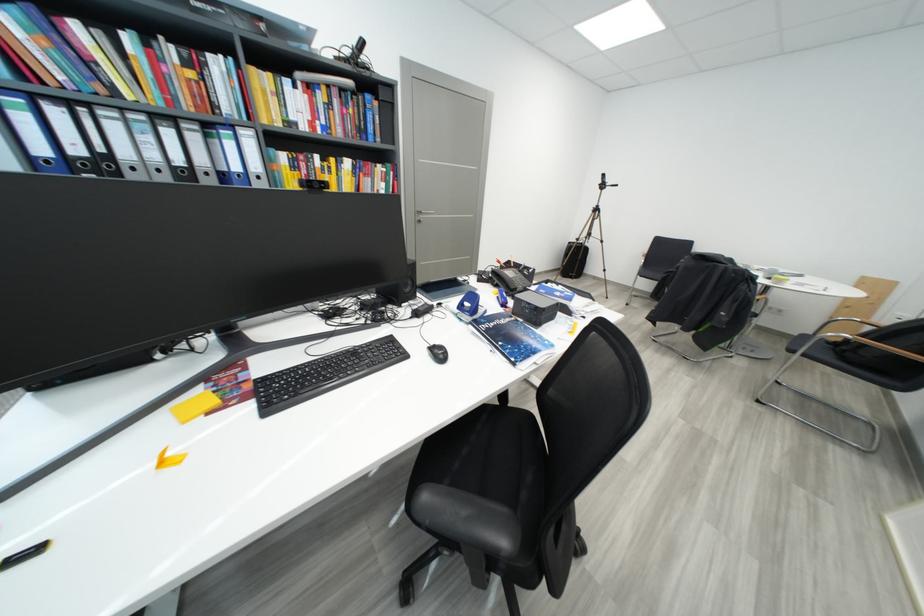
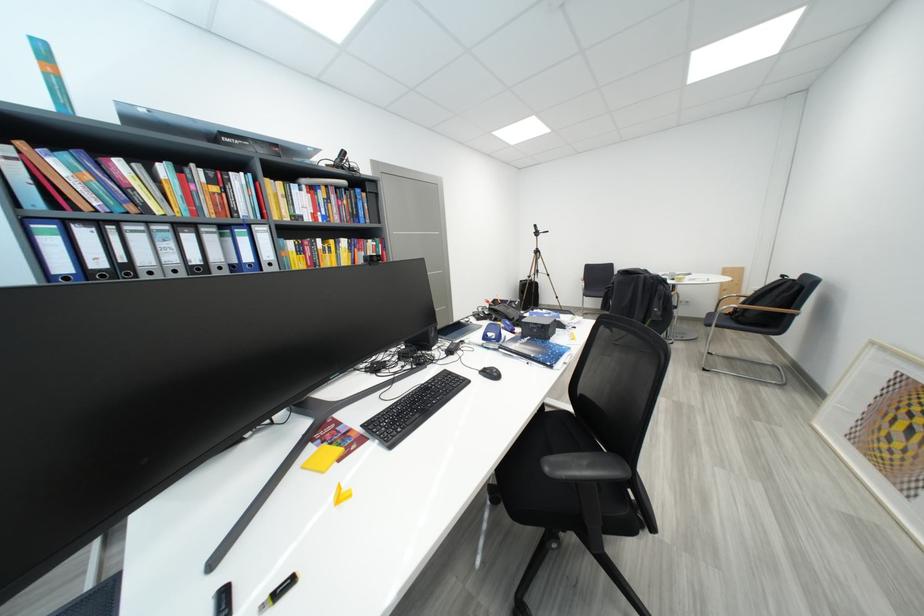
The point at (853, 362) is marked in the first image. Where is the corresponding point in the second image?

(748, 325)